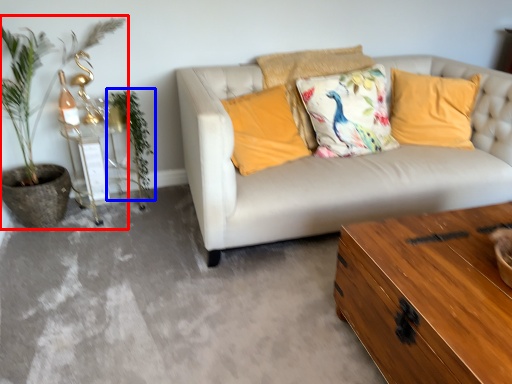
Question: Which of the following is the farthest to the observer, houseplant (highlighted by a red box) or plant (highlighted by a blue box)?

Choices:
 (A) houseplant
 (B) plant

Answer: (B)